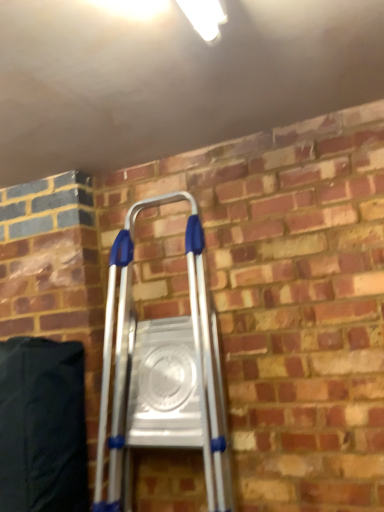
Question: From a real-world perspective, is silver metallic ladder at center under black fabric bean bag chair at lower left?

Choices:
 (A) yes
 (B) no

Answer: (B)

Question: Is silver metallic ladder at center bigger than black fabric bean bag chair at lower left?

Choices:
 (A) no
 (B) yes

Answer: (B)

Question: Can you confirm if silver metallic ladder at center is positioned to the left of black fabric bean bag chair at lower left?

Choices:
 (A) yes
 (B) no

Answer: (B)

Question: Can you confirm if silver metallic ladder at center is thinner than black fabric bean bag chair at lower left?

Choices:
 (A) no
 (B) yes

Answer: (A)

Question: Can you confirm if silver metallic ladder at center is shorter than black fabric bean bag chair at lower left?

Choices:
 (A) yes
 (B) no

Answer: (B)

Question: Is silver metallic ladder at center positioned before black fabric bean bag chair at lower left?

Choices:
 (A) no
 (B) yes

Answer: (B)

Question: Can you confirm if black fabric bean bag chair at lower left is taller than silver metallic ladder at center?

Choices:
 (A) no
 (B) yes

Answer: (A)

Question: Can you confirm if black fabric bean bag chair at lower left is positioned to the left of silver metallic ladder at center?

Choices:
 (A) yes
 (B) no

Answer: (A)

Question: Is black fabric bean bag chair at lower left positioned with its back to silver metallic ladder at center?

Choices:
 (A) no
 (B) yes

Answer: (A)

Question: From a real-world perspective, is black fabric bean bag chair at lower left on top of silver metallic ladder at center?

Choices:
 (A) yes
 (B) no

Answer: (B)

Question: Considering the relative sizes of black fabric bean bag chair at lower left and silver metallic ladder at center in the image provided, is black fabric bean bag chair at lower left wider than silver metallic ladder at center?

Choices:
 (A) no
 (B) yes

Answer: (A)

Question: Considering the relative positions of black fabric bean bag chair at lower left and silver metallic ladder at center in the image provided, is black fabric bean bag chair at lower left to the right of silver metallic ladder at center from the viewer's perspective?

Choices:
 (A) yes
 (B) no

Answer: (B)

Question: Choose the correct answer: Is black fabric bean bag chair at lower left inside silver metallic ladder at center or outside it?

Choices:
 (A) inside
 (B) outside

Answer: (B)